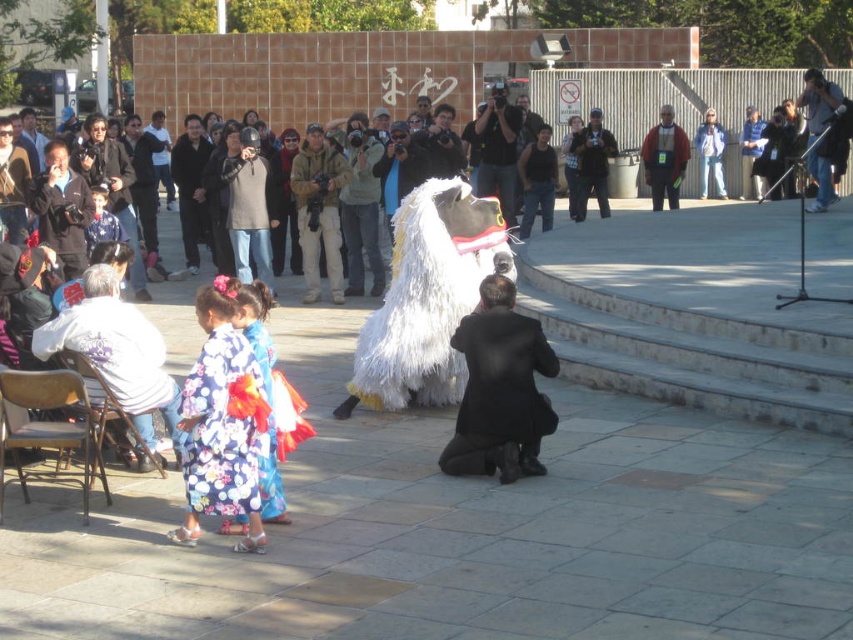
You are standing at the origin point of the image. Which direction should you move to reach the floral silk kimono at center?

The floral silk kimono at center is located at point 0.669 on the x axis and 0.264 on the y axis, so you should move towards the right and slightly upwards to reach it.

You are a photographer at the event and need to position two jackets on a rack. The scene shows a matte black jacket at upper right and a denim jacket at upper center. According to the spatial arrangement in the image, which jacket should be placed to the left of the other on the rack?

The matte black jacket at upper right should be placed to the left of the denim jacket at upper center because in the image, the matte black jacket at upper right is positioned on the left side of the denim jacket at upper center.